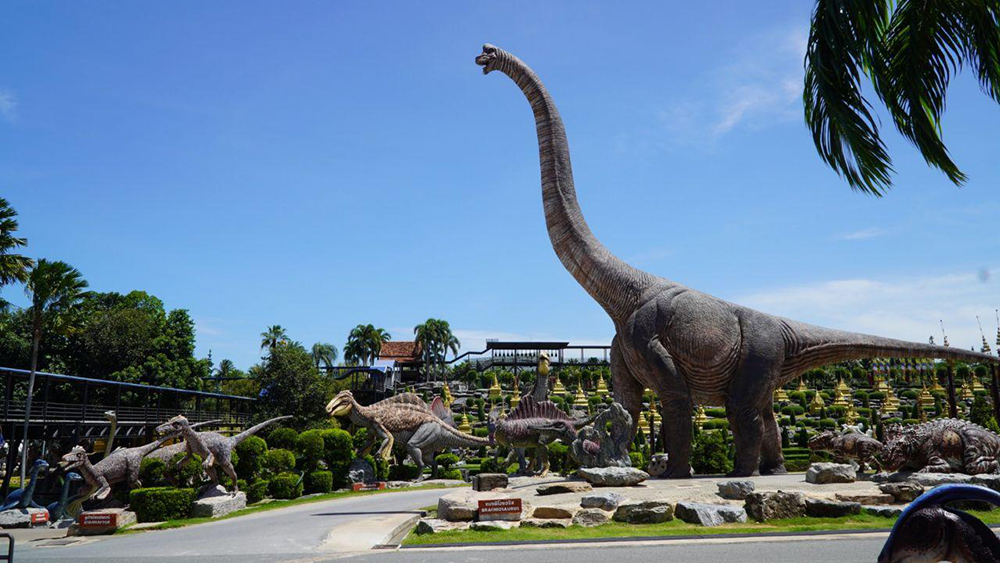
I want to click on glass, so click(932, 529).